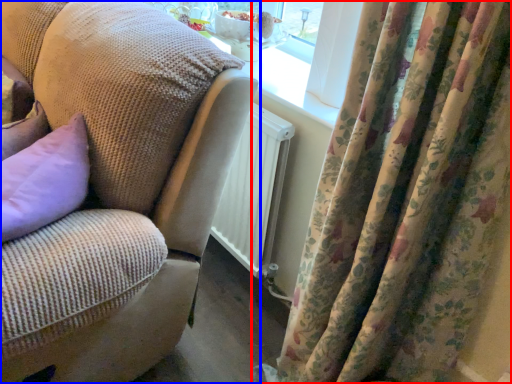
Question: Which of the following is the closest to the observer, curtain (highlighted by a red box) or studio couch (highlighted by a blue box)?

Choices:
 (A) curtain
 (B) studio couch

Answer: (A)